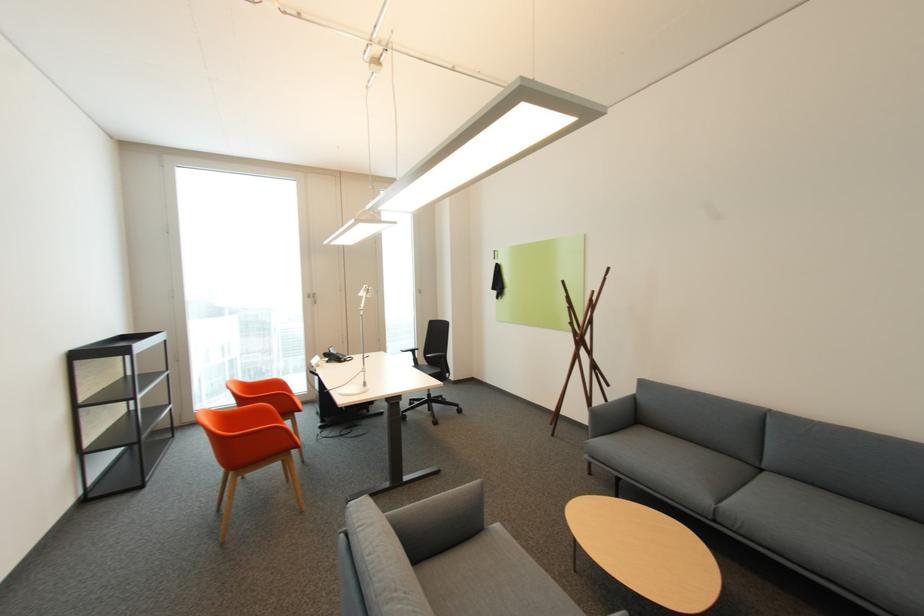
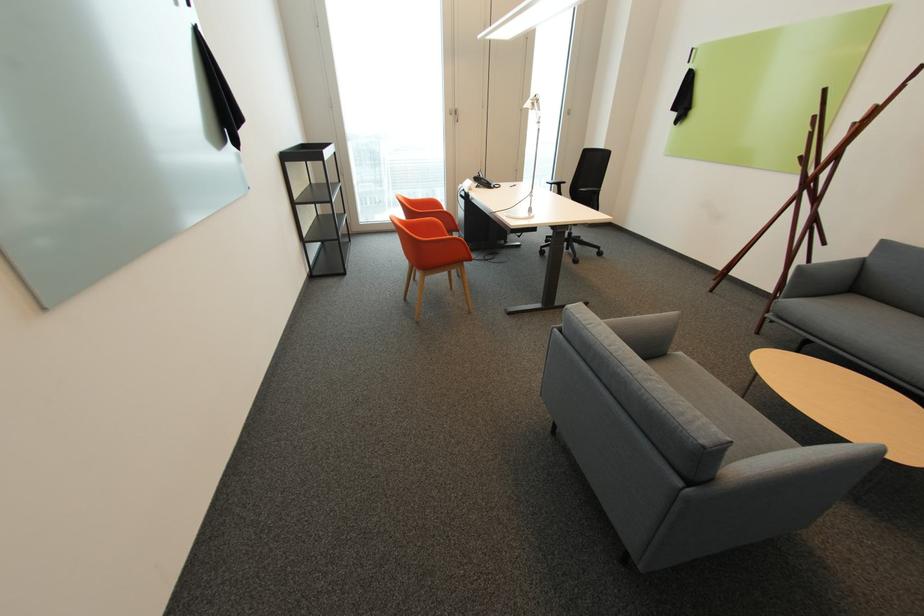
Find the pixel in the second image that matches pixel 407 351 in the first image.

(553, 183)